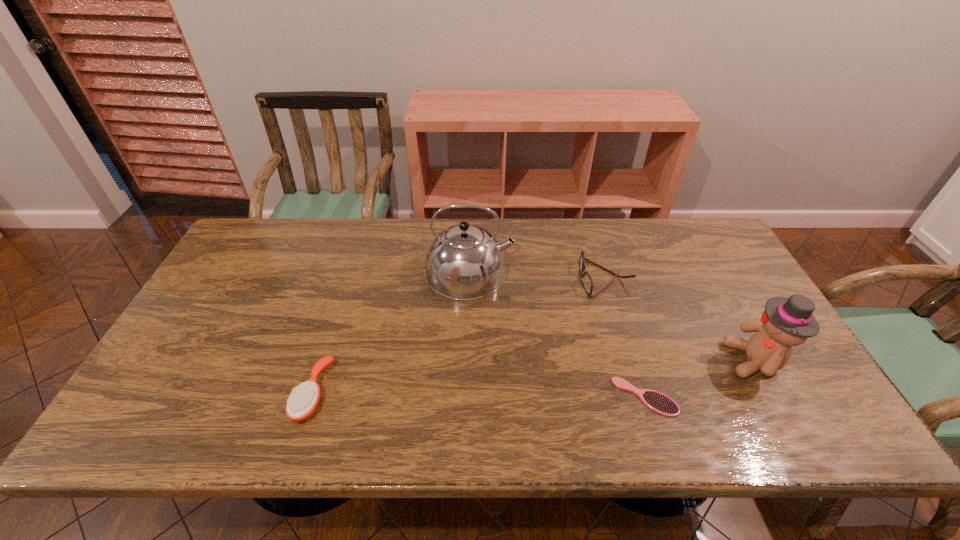
The height and width of the screenshot is (540, 960). I want to click on vacant region at the far edge, so click(x=660, y=257).

Where is `free space at the near edge of the desktop`? free space at the near edge of the desktop is located at coordinates (668, 435).

You are a GUI agent. You are given a task and a screenshot of the screen. Output one action in this format:
    pyautogui.click(x=<x>, y=<y>)
    Task: Click on the vacant space in between the fourth object from right to left and the left hairbrush
    
    Given the screenshot: What is the action you would take?
    pos(391,332)

At what (x,y) coordinates should I click in order to perform the action: click on vacant region between the fourth object from right to left and the shorter hairbrush. Please return your answer as a coordinate pair (x, y). The height and width of the screenshot is (540, 960). Looking at the image, I should click on (558, 334).

This screenshot has width=960, height=540. I want to click on free space between the spectacles and the rag_doll, so click(x=680, y=319).

The image size is (960, 540). Identify the location of blank region between the kettle and the rightmost object. (612, 316).

The height and width of the screenshot is (540, 960). Find the location of `free area in between the spectacles and the second object from left to right`. free area in between the spectacles and the second object from left to right is located at coordinates (538, 275).

Image resolution: width=960 pixels, height=540 pixels. Identify the location of free spot between the kettle and the rag_doll. (612, 316).

In order to click on vacant space that's between the second object from left to right and the rightmost object in this screenshot , I will do `click(612, 316)`.

The height and width of the screenshot is (540, 960). What are the coordinates of `unoccupied area between the left hairbrush and the kettle` in the screenshot? It's located at (391, 332).